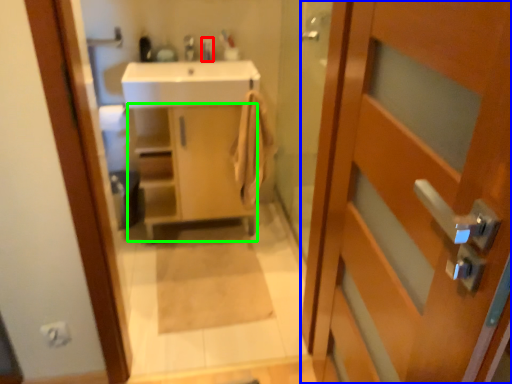
Question: Based on their relative distances, which object is farther from toiletry (highlighted by a red box)? Choose from door (highlighted by a blue box) and cabinetry (highlighted by a green box).

Choices:
 (A) door
 (B) cabinetry

Answer: (A)